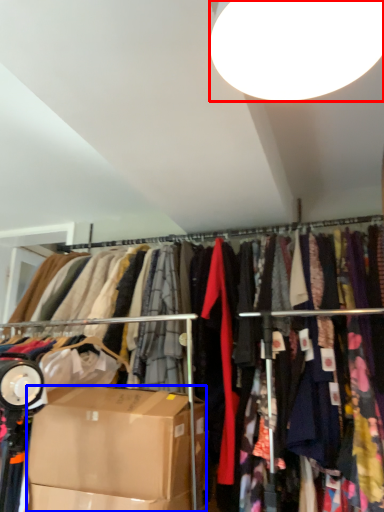
Question: Which of the following is the farthest to the observer, lamp (highlighted by a red box) or box (highlighted by a blue box)?

Choices:
 (A) lamp
 (B) box

Answer: (B)